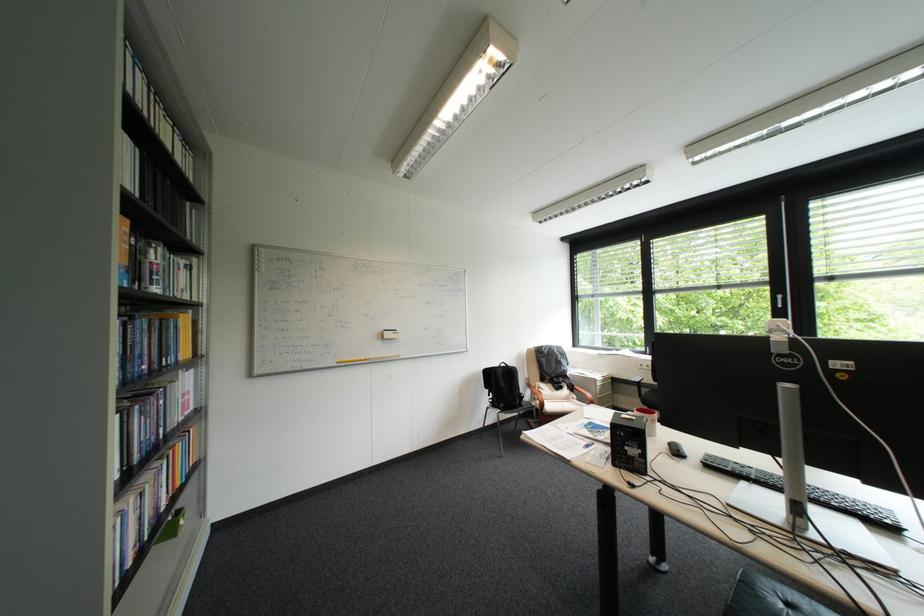
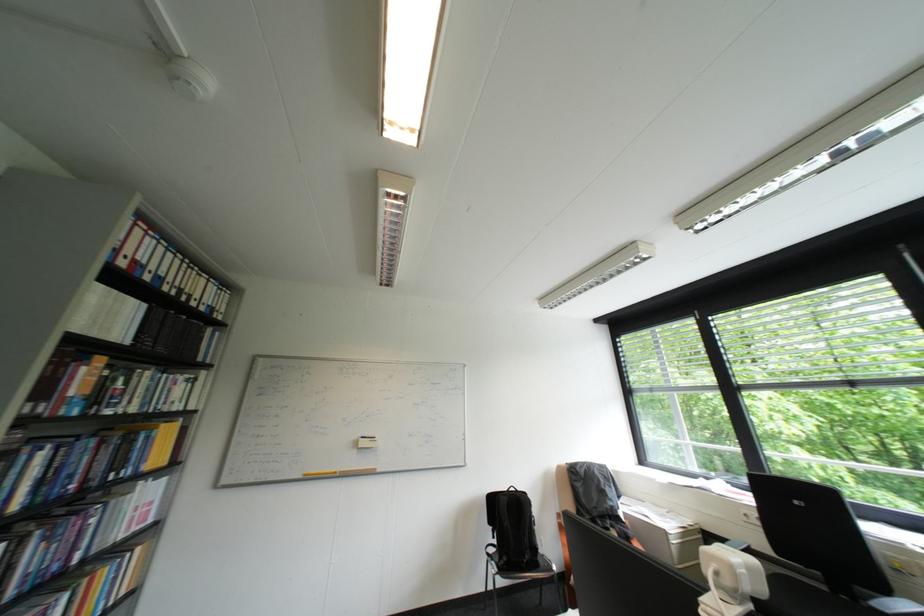
Question: What movement of the cameraman would produce the second image?

Choices:
 (A) Left
 (B) Right
 (C) Forward
 (D) Backward

Answer: (B)